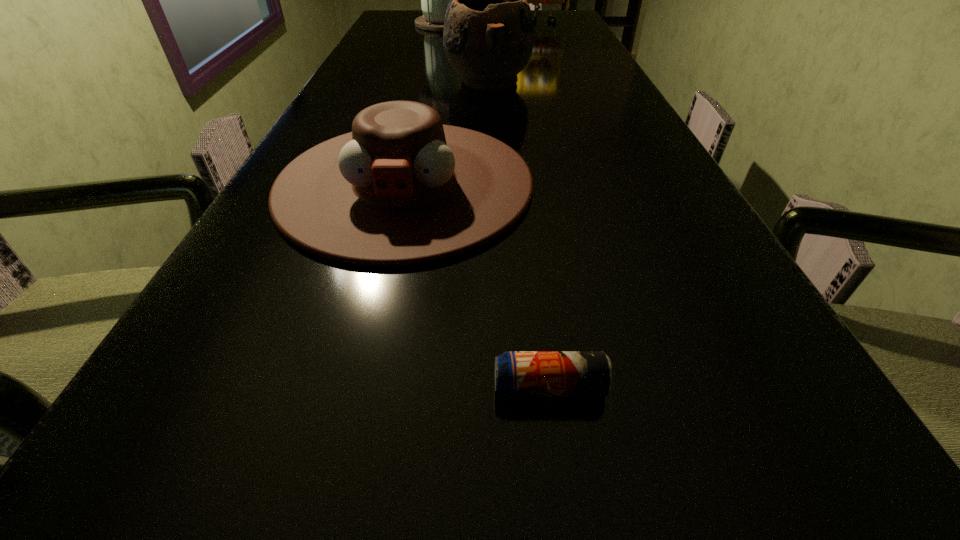
Find the location of `free region at the left edge of the desktop`. free region at the left edge of the desktop is located at coordinates (381, 84).

I want to click on vacant space at the right edge of the desktop, so click(614, 227).

This screenshot has width=960, height=540. Find the location of `free space at the far right corner`. free space at the far right corner is located at coordinates (562, 23).

You are a GUI agent. You are given a task and a screenshot of the screen. Output one action in this format:
    pyautogui.click(x=<x>, y=<y>)
    Task: Click on the free space that is in between the beer can and the fourth shortest object
    
    Given the screenshot: What is the action you would take?
    pyautogui.click(x=546, y=204)

Find the location of a particular element. free spot between the nearest object and the second shortest object is located at coordinates (477, 285).

The width and height of the screenshot is (960, 540). Find the location of `free space between the second nearest object and the sponge`. free space between the second nearest object and the sponge is located at coordinates (473, 103).

Identify the location of the third closest object to the second nearest object. (434, 0).

The width and height of the screenshot is (960, 540). I want to click on object that ranks as the fourth closest to the fourth tallest object, so (x=535, y=0).

The image size is (960, 540). Find the location of `vacant region that satisfies the following two spatial constraints: 1. on the front side of the third nearest object; 2. on the right side of the shortest object`. vacant region that satisfies the following two spatial constraints: 1. on the front side of the third nearest object; 2. on the right side of the shortest object is located at coordinates (499, 387).

In order to click on free space in the image that satisfies the following two spatial constraints: 1. on the front-facing side of the fourth farthest object; 2. on the right side of the beer can in this screenshot , I will do `click(357, 387)`.